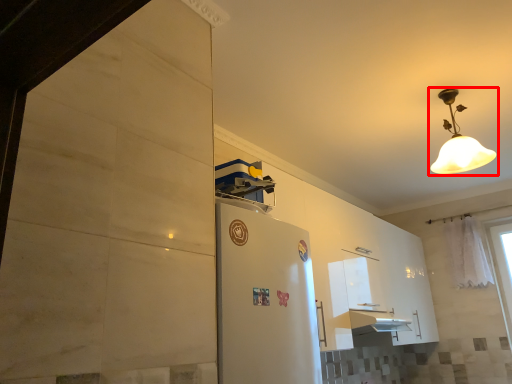
Question: From the image's perspective, what is the correct spatial relationship of lamp (annotated by the red box) in relation to curtain?

Choices:
 (A) below
 (B) above

Answer: (B)